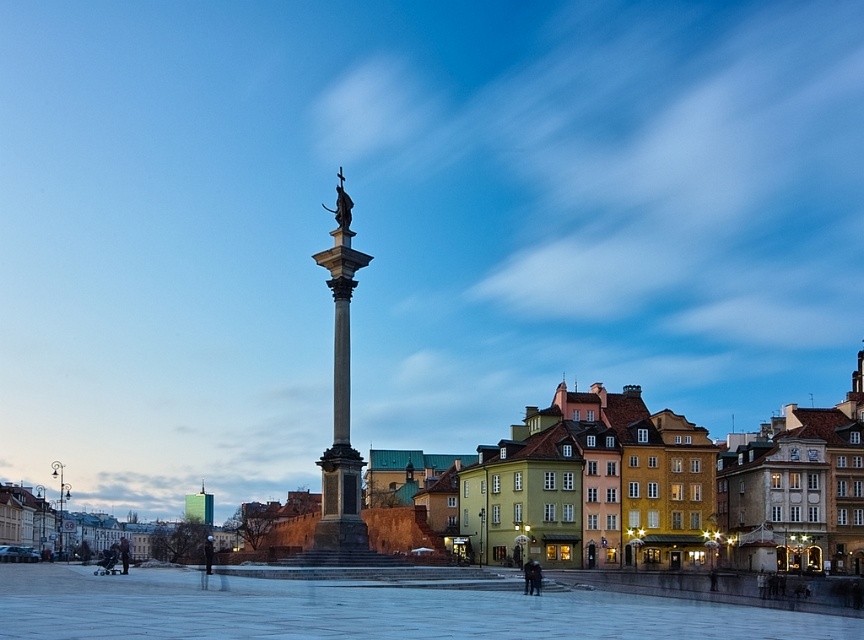
Question: Does polished stone column at center appear on the left side of polished bronze statue at center?

Choices:
 (A) yes
 (B) no

Answer: (B)

Question: Does polished stone column at center appear on the left side of polished bronze statue at center?

Choices:
 (A) yes
 (B) no

Answer: (B)

Question: Which point is farther from the camera taking this photo?

Choices:
 (A) (348, 205)
 (B) (338, 195)

Answer: (B)

Question: Does polished stone column at center have a lesser width compared to polished bronze statue at center?

Choices:
 (A) yes
 (B) no

Answer: (A)

Question: Which point is closer to the camera?

Choices:
 (A) polished bronze statue at center
 (B) polished stone column at center

Answer: (B)